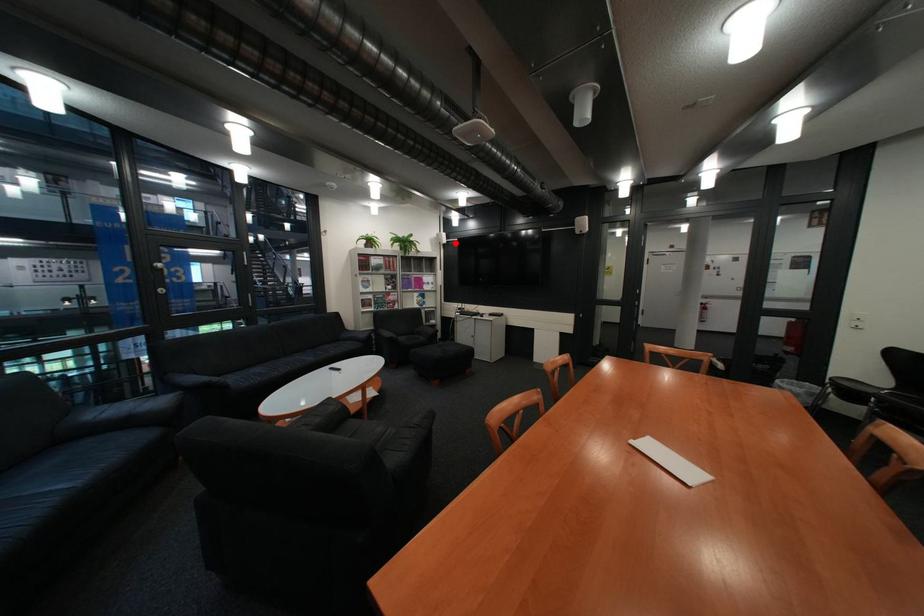
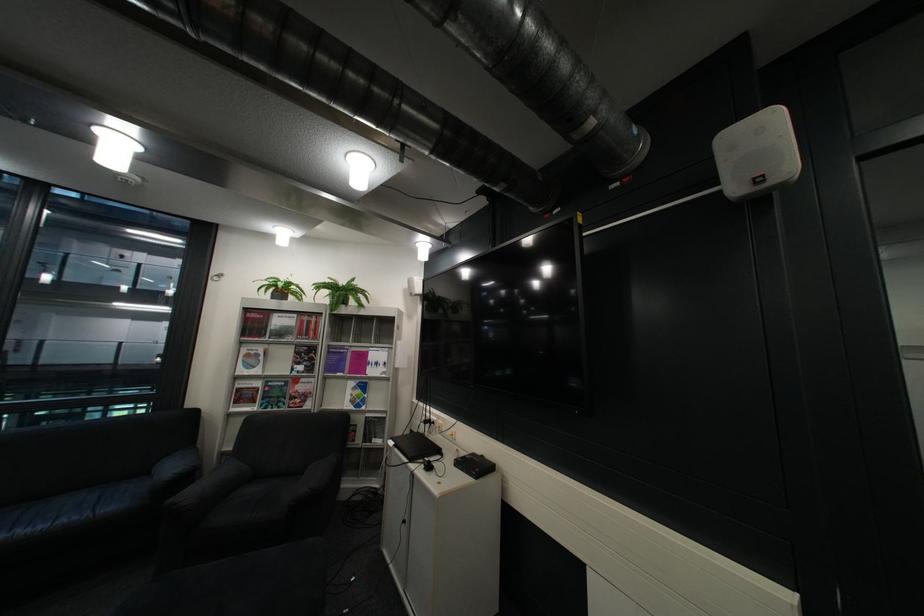
Find the pixel in the second image that matches the highlighted location in the first image.

(427, 294)